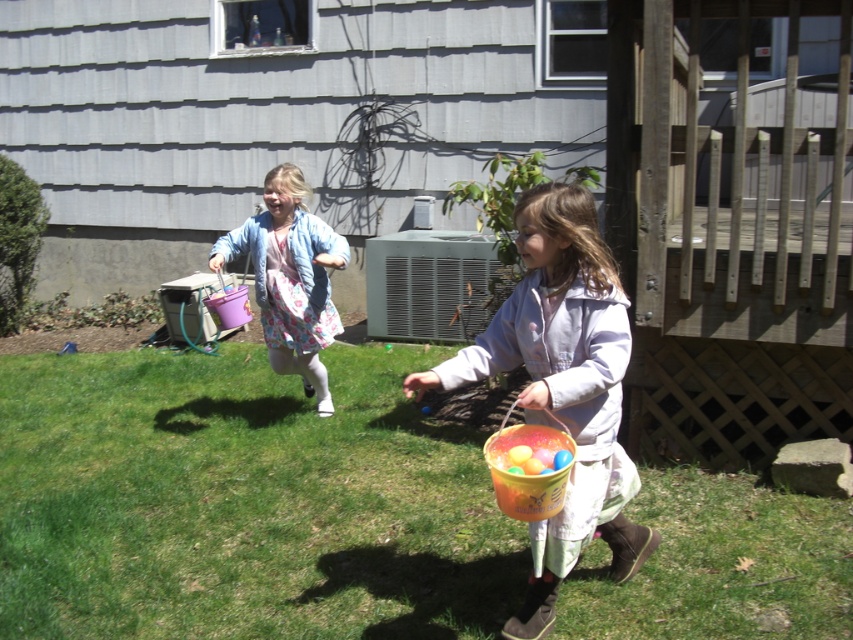
You are organizing an Easter egg hunt and have two buckets to choose from. Which bucket, the matte orange bucket at center or the matte pink bucket at center, can hold more eggs?

The matte pink bucket at center is larger than the matte orange bucket at center, so it can hold more eggs.

You are a parent trying to find your children who are hiding Easter eggs in the backyard. You see the green grass at lower center and the matte orange bucket at center. Which object is closer to you?

The matte orange bucket at center is closer to you since it is located at the center, while the green grass at lower center is further away.

You are a gardener who needs to plant a flower in the green grass at lower center. However, you have a tool that requires at least 6 inches of clearance. Can you use the tool here without hitting the matte orange bucket at center?

The green grass at lower center is not as tall as the matte orange bucket at center, but the description does not provide specific measurements for the grass height or the bucket height. Therefore, it is unclear if the grass is tall enough to allow 6 inches of clearance for the tool.